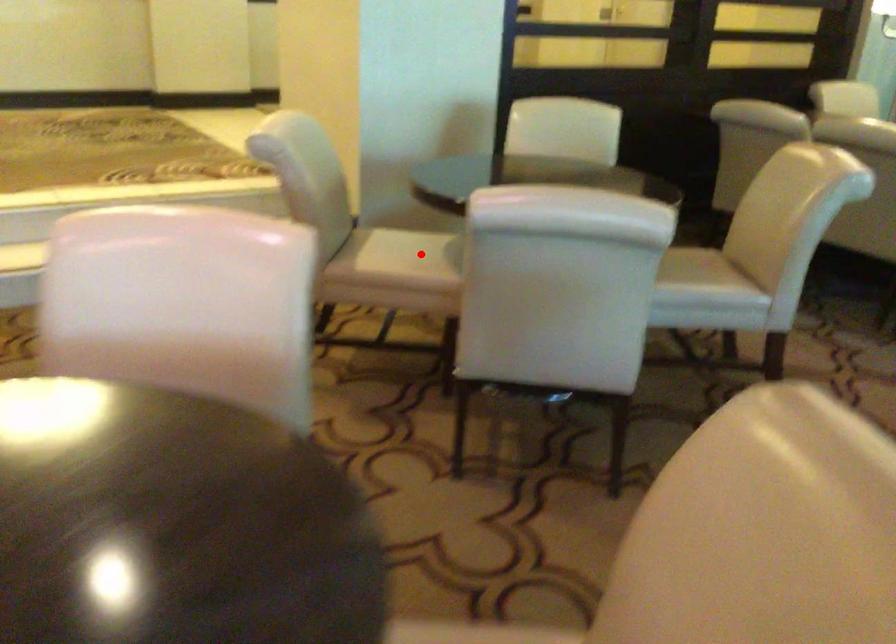
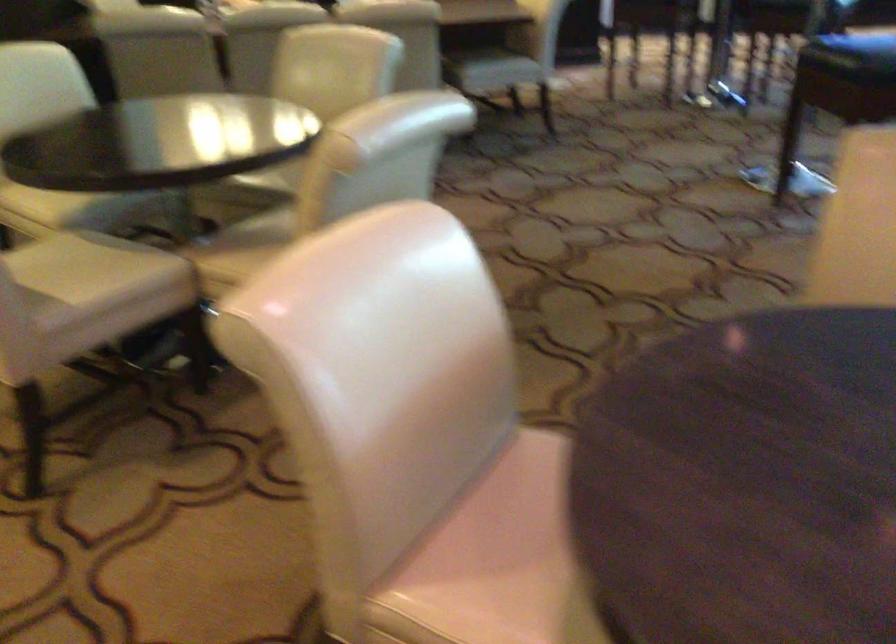
Question: I am providing you with two images of the same scene from different viewpoints. Image1 has a red point marked. In image2, the corresponding 3D location appears at what relative position? Reply with the corresponding letter.

Choices:
 (A) Closer
 (B) Farther

Answer: (A)